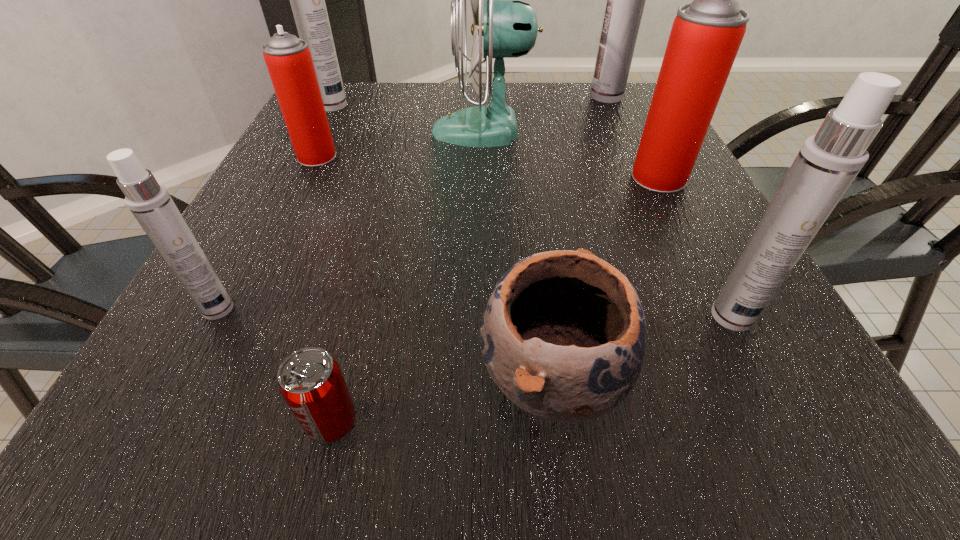
This screenshot has width=960, height=540. Find the location of `free space between the fan and the right red aerosol can`. free space between the fan and the right red aerosol can is located at coordinates (571, 154).

The width and height of the screenshot is (960, 540). In order to click on vacant area that lies between the tallest object and the third biggest white aerosol can in this screenshot , I will do `click(669, 207)`.

Where is `the eighth closest object to the third biggest white aerosol can`? Image resolution: width=960 pixels, height=540 pixels. the eighth closest object to the third biggest white aerosol can is located at coordinates pos(307,0).

Identify which object is the closest to the teal fan. Please provide its 2D coordinates. Your answer should be formatted as a tuple, i.e. [(x, y)], where the tuple contains the x and y coordinates of a point satisfying the conditions above.

[(625, 0)]

Locate which aerosol can ranks second in proximity to the smallest white aerosol can. Please provide its 2D coordinates. Your answer should be formatted as a tuple, i.e. [(x, y)], where the tuple contains the x and y coordinates of a point satisfying the conditions above.

[(307, 0)]

Select which aerosol can appears as the third closest to the smallest white aerosol can. Please provide its 2D coordinates. Your answer should be formatted as a tuple, i.e. [(x, y)], where the tuple contains the x and y coordinates of a point satisfying the conditions above.

[(828, 162)]

I want to click on white aerosol can that is the closest to the fan, so click(x=625, y=0).

Identify the location of white aerosol can that is the fourth closest one to the shortest object. (625, 0).

Find the location of a particular element. The width and height of the screenshot is (960, 540). free space that satisfies the following two spatial constraints: 1. in front of the second smallest white aerosol can, directing airflow; 2. on the right side of the teal fan is located at coordinates [485, 316].

Locate an element on the screen. The height and width of the screenshot is (540, 960). vacant position in the image that satisfies the following two spatial constraints: 1. on the front side of the third biggest white aerosol can; 2. on the right side of the smallest white aerosol can is located at coordinates (214, 316).